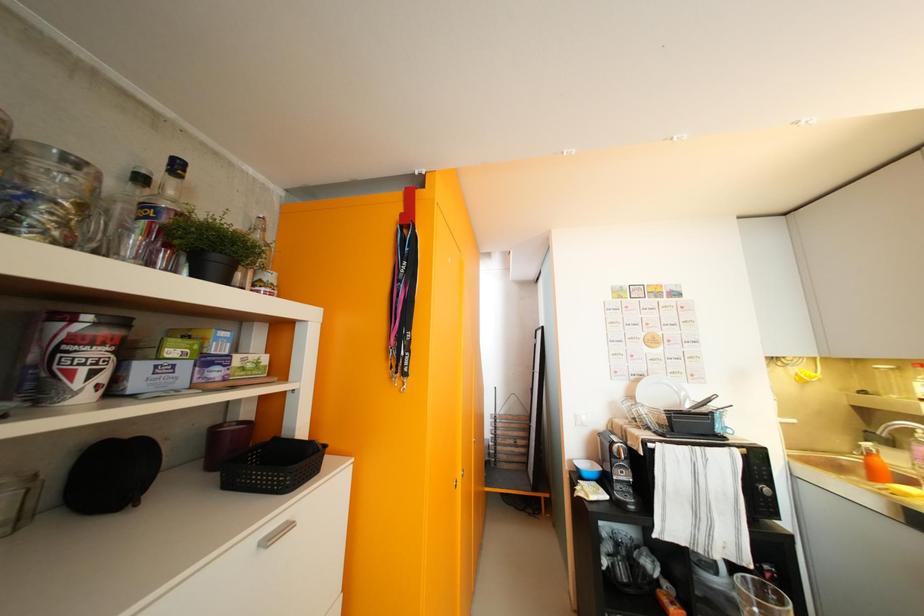
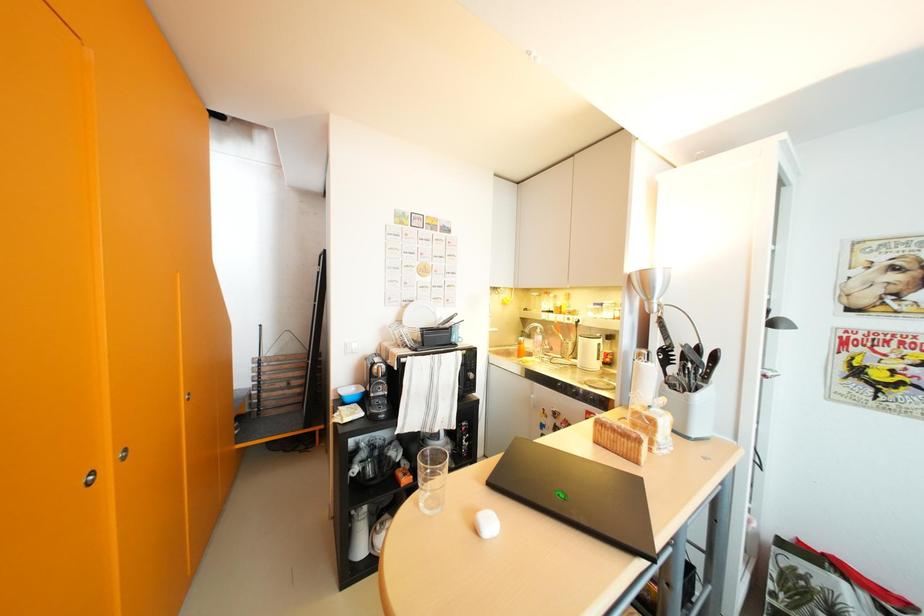
Question: The images are taken continuously from a first-person perspective. In which direction is your viewpoint rotating?

Choices:
 (A) Left
 (B) Right
 (C) Up
 (D) Down

Answer: (B)